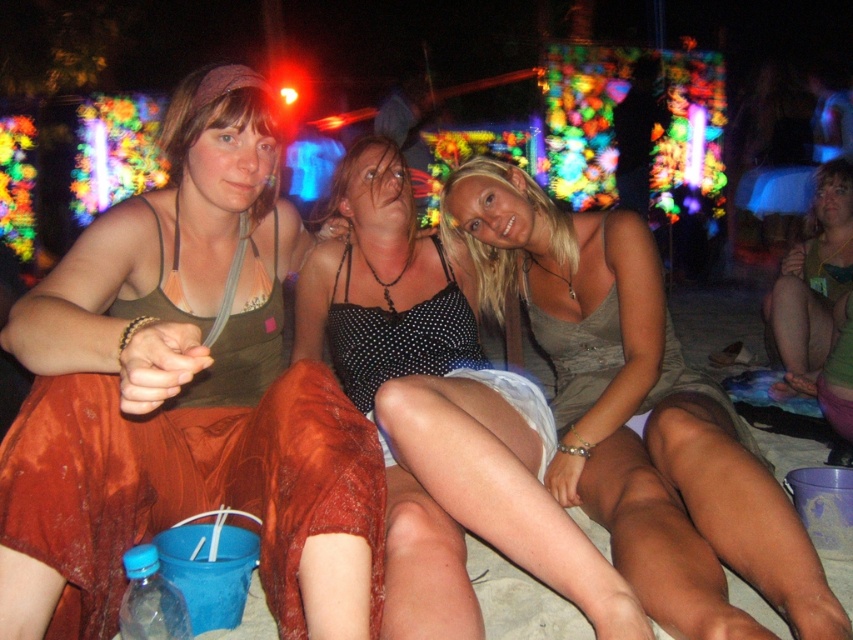
Does matte green tank top at center have a lesser width compared to matte gray dress at center?

Correct, matte green tank top at center's width is less than matte gray dress at center's.

Is point (120, 342) closer to camera compared to point (672, 461)?

That is True.

What do you see at coordinates (184, 396) in the screenshot? I see `matte green tank top at center` at bounding box center [184, 396].

Where is `matte green tank top at center`? The image size is (853, 640). matte green tank top at center is located at coordinates (184, 396).

Can you confirm if matte gray dress at center is bigger than green fabric dress at lower right?

Indeed, matte gray dress at center has a larger size compared to green fabric dress at lower right.

Is point (730, 548) less distant than point (828, 305)?

Yes.

The image size is (853, 640). I want to click on matte gray dress at center, so click(639, 413).

Who is higher up, matte green tank top at center or green fabric dress at lower right?

green fabric dress at lower right is above.

Between matte green tank top at center and green fabric dress at lower right, which one has more height?

With more height is green fabric dress at lower right.

Locate an element on the screen. This screenshot has height=640, width=853. matte green tank top at center is located at coordinates (x=184, y=396).